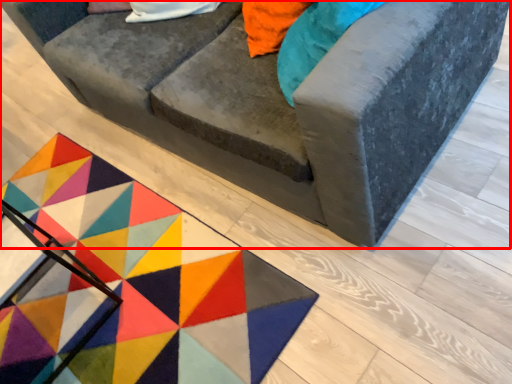
Question: From the image's perspective, considering the relative positions of studio couch (annotated by the red box) and mat in the image provided, where is studio couch (annotated by the red box) located with respect to the staircase?

Choices:
 (A) above
 (B) below

Answer: (A)